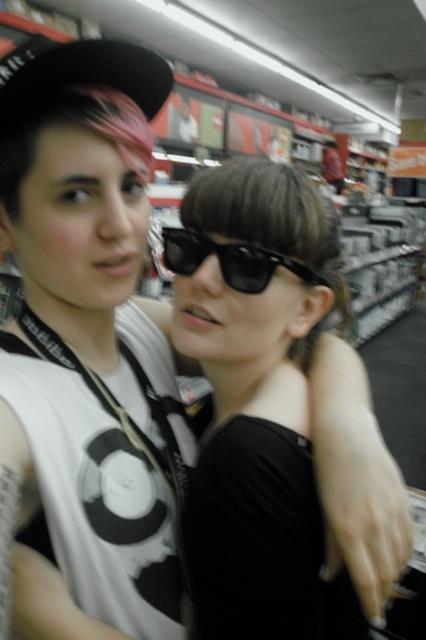
Question: Does black matte sunglasses at center have a larger size compared to black plastic sunglasses at center?

Choices:
 (A) yes
 (B) no

Answer: (A)

Question: Can you confirm if black matte sunglasses at center is positioned to the left of black matte dress at center?

Choices:
 (A) no
 (B) yes

Answer: (A)

Question: Among these points, which one is nearest to the camera?

Choices:
 (A) (164, 250)
 (B) (239, 604)

Answer: (B)

Question: Which point is closer to the camera?

Choices:
 (A) (232, 268)
 (B) (233, 612)
 (C) (291, 202)

Answer: (B)

Question: Which point is closer to the camera taking this photo?

Choices:
 (A) (282, 304)
 (B) (207, 237)

Answer: (B)

Question: Does black matte sunglasses at center appear under black plastic sunglasses at center?

Choices:
 (A) yes
 (B) no

Answer: (A)